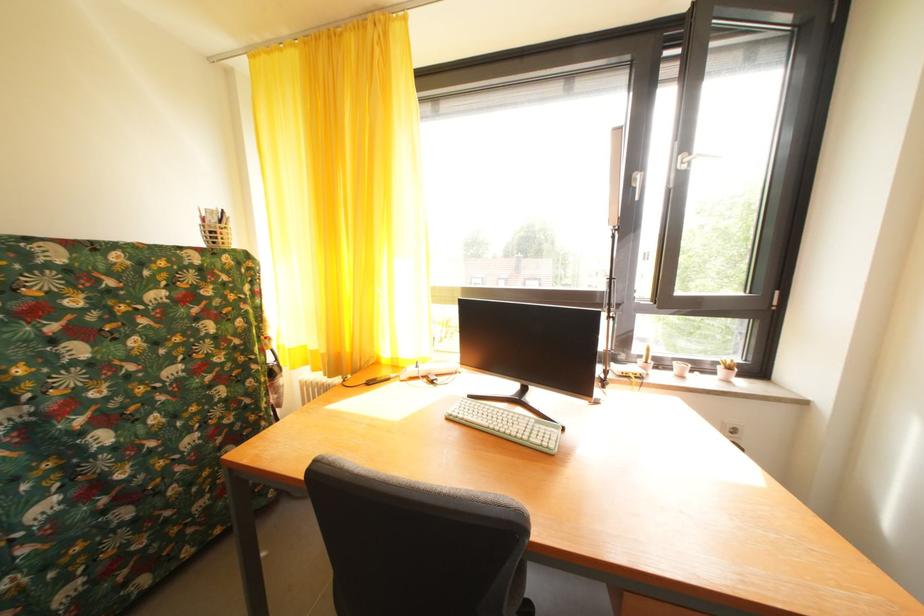
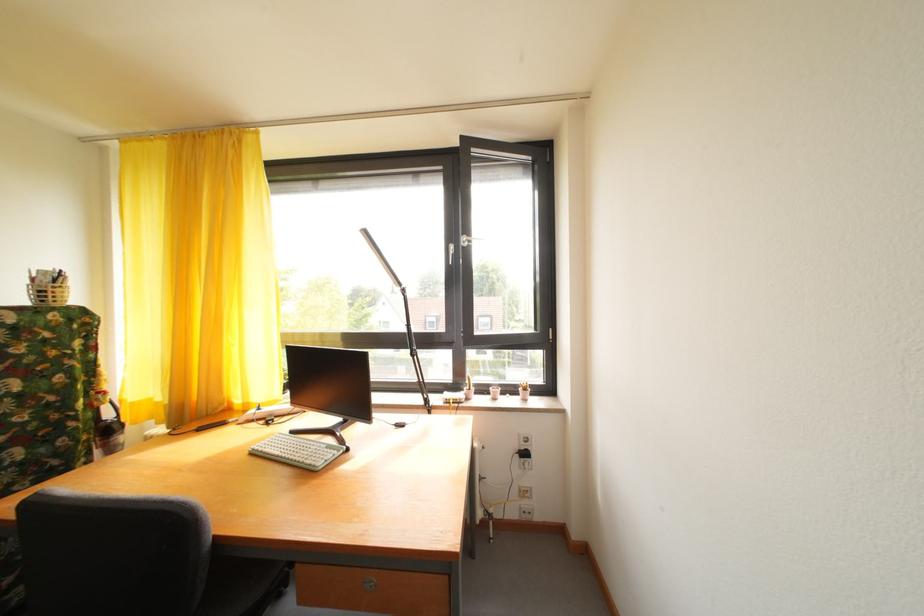
Locate, in the second image, the point that corresponds to (479,402) in the first image.

(301, 438)